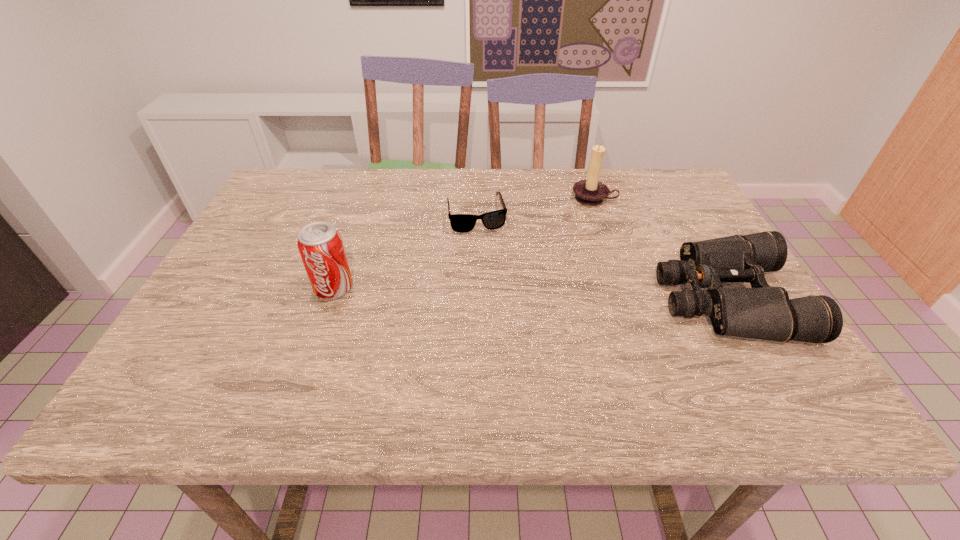
Where is `the leftmost object`? Image resolution: width=960 pixels, height=540 pixels. the leftmost object is located at coordinates (320, 245).

Where is `the third tallest object`? This screenshot has height=540, width=960. the third tallest object is located at coordinates coord(765,312).

Where is `binoculars`? binoculars is located at coordinates (765, 312).

In order to click on candle holder in this screenshot , I will do `click(590, 192)`.

Where is `the shortest object`? This screenshot has width=960, height=540. the shortest object is located at coordinates (462, 223).

Image resolution: width=960 pixels, height=540 pixels. I want to click on sunglasses, so click(462, 223).

Where is `vacant space located 0.060m on the right of the soda can`? The width and height of the screenshot is (960, 540). vacant space located 0.060m on the right of the soda can is located at coordinates (380, 288).

Locate an element on the screen. Image resolution: width=960 pixels, height=540 pixels. free spot located 0.320m through the eyepieces of the binoculars is located at coordinates (516, 299).

Find the location of a particular element. Image resolution: width=960 pixels, height=540 pixels. free space located through the eyepieces of the binoculars is located at coordinates (603, 299).

The height and width of the screenshot is (540, 960). I want to click on vacant region located 0.170m through the eyepieces of the binoculars, so click(x=585, y=299).